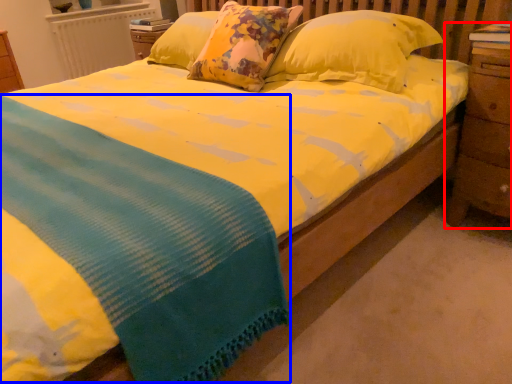
Question: Which object appears closest to the camera in this image, nightstand (highlighted by a red box) or blanket (highlighted by a blue box)?

Choices:
 (A) nightstand
 (B) blanket

Answer: (B)